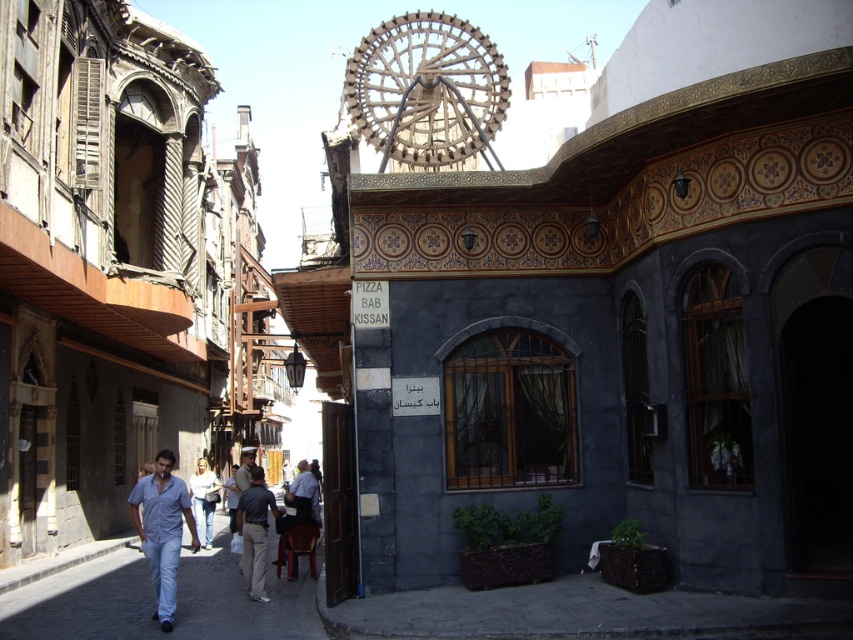
Is point (102, 589) behind point (258, 540)?

Yes, it is behind point (258, 540).

Can you confirm if light blue jeans at lower left is bigger than dark gray pants at center?

Yes, light blue jeans at lower left is bigger than dark gray pants at center.

Identify the location of light blue jeans at lower left. (154, 600).

The image size is (853, 640). I want to click on light blue jeans at lower left, so click(154, 600).

Does light blue jeans at lower left have a lesser height compared to wooden at upper center?

Correct, light blue jeans at lower left is not as tall as wooden at upper center.

Between light blue jeans at lower left and wooden at upper center, which one has less height?

light blue jeans at lower left is shorter.

Where is `light blue jeans at lower left`? This screenshot has width=853, height=640. light blue jeans at lower left is located at coordinates (154, 600).

Describe the element at coordinates (426, 90) in the screenshot. This screenshot has width=853, height=640. I see `wooden at upper center` at that location.

Is point (457, 74) in front of point (196, 538)?

No, (457, 74) is behind (196, 538).

The height and width of the screenshot is (640, 853). Identify the location of wooden at upper center. (426, 90).